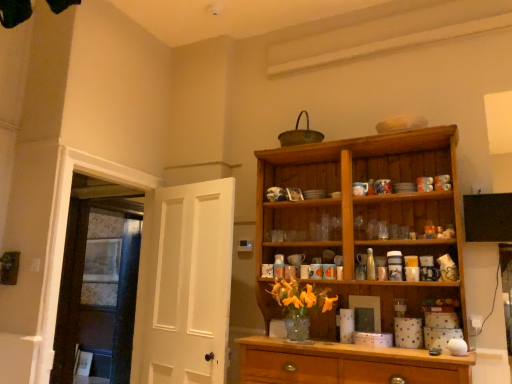
Question: Can we say white matte door at left, marked as the second door in a back-to-front arrangement, lies outside white wooden door at left, which is counted as the 1th door, starting from the back?

Choices:
 (A) no
 (B) yes

Answer: (B)

Question: From a real-world perspective, is white matte door at left, the first door in the right-to-left sequence, physically above white wooden door at left, which is counted as the 1th door, starting from the back?

Choices:
 (A) yes
 (B) no

Answer: (A)

Question: Does white matte door at left, the first door in the right-to-left sequence, have a greater width compared to white wooden door at left, which is counted as the 1th door, starting from the back?

Choices:
 (A) yes
 (B) no

Answer: (B)

Question: From the image's perspective, is white matte door at left, marked as the second door in a back-to-front arrangement, over white wooden door at left, marked as the second door in a right-to-left arrangement?

Choices:
 (A) yes
 (B) no

Answer: (A)

Question: Considering the relative sizes of white matte door at left, the first door when ordered from front to back, and white wooden door at left, marked as the second door in a right-to-left arrangement, in the image provided, is white matte door at left, the first door when ordered from front to back, thinner than white wooden door at left, marked as the second door in a right-to-left arrangement,?

Choices:
 (A) no
 (B) yes

Answer: (B)

Question: Considering the positions of white matte door at left, marked as the second door in a back-to-front arrangement, and wooden cabinet at right in the image, is white matte door at left, marked as the second door in a back-to-front arrangement, taller or shorter than wooden cabinet at right?

Choices:
 (A) short
 (B) tall

Answer: (A)

Question: Is white matte door at left, the first door when ordered from front to back, in front of or behind wooden cabinet at right in the image?

Choices:
 (A) front
 (B) behind

Answer: (B)

Question: Looking at their shapes, would you say white matte door at left, the first door in the right-to-left sequence, is wider or thinner than wooden cabinet at right?

Choices:
 (A) thin
 (B) wide

Answer: (A)

Question: Is white matte door at left, marked as the second door in a back-to-front arrangement, situated inside wooden cabinet at right or outside?

Choices:
 (A) inside
 (B) outside

Answer: (B)

Question: Considering the positions of white matte door at left, the first door in the right-to-left sequence, and white wooden door at left, which appears as the 2th door when viewed from the front, in the image, is white matte door at left, the first door in the right-to-left sequence, bigger or smaller than white wooden door at left, which appears as the 2th door when viewed from the front,?

Choices:
 (A) small
 (B) big

Answer: (A)

Question: Considering the positions of point (161, 314) and point (140, 211), is point (161, 314) closer or farther from the camera than point (140, 211)?

Choices:
 (A) closer
 (B) farther

Answer: (A)

Question: Looking at their shapes, would you say white matte door at left, the first door in the right-to-left sequence, is wider or thinner than white wooden door at left, acting as the first door starting from the left?

Choices:
 (A) wide
 (B) thin

Answer: (B)

Question: Is white matte door at left, marked as the second door in a back-to-front arrangement, taller or shorter than white wooden door at left, acting as the first door starting from the left?

Choices:
 (A) short
 (B) tall

Answer: (A)

Question: Relative to white matte door at left, the first door in the right-to-left sequence, is white wooden door at left, marked as the second door in a right-to-left arrangement, in front or behind?

Choices:
 (A) behind
 (B) front

Answer: (A)

Question: From the image's perspective, is white wooden door at left, acting as the first door starting from the left, positioned above or below white matte door at left, the first door when ordered from front to back?

Choices:
 (A) below
 (B) above

Answer: (A)